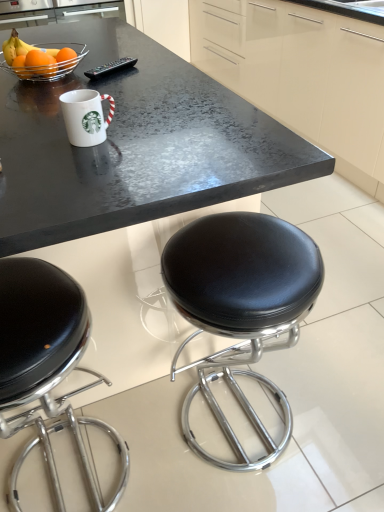
This screenshot has height=512, width=384. Find the location of `free space in front of white glossy mug at upper center`. free space in front of white glossy mug at upper center is located at coordinates (97, 167).